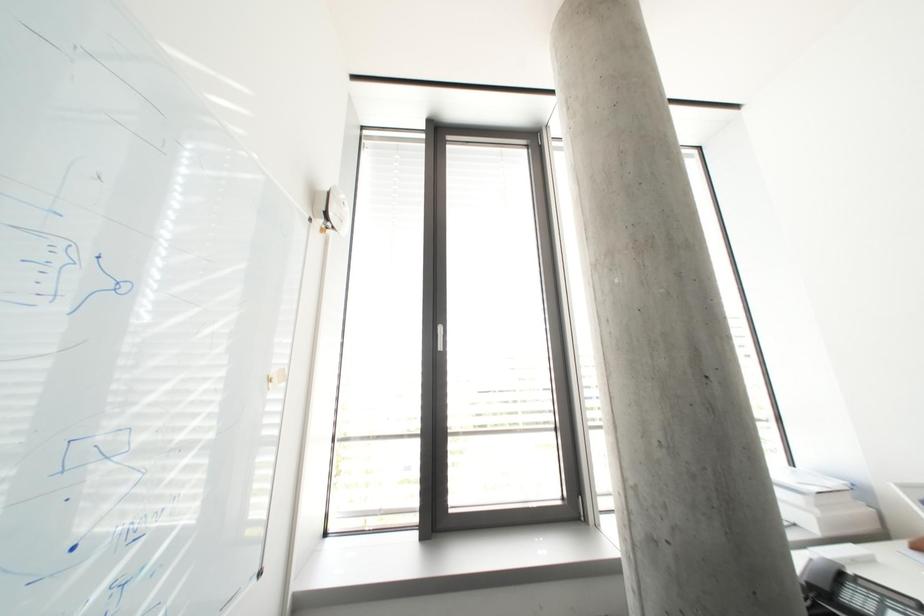
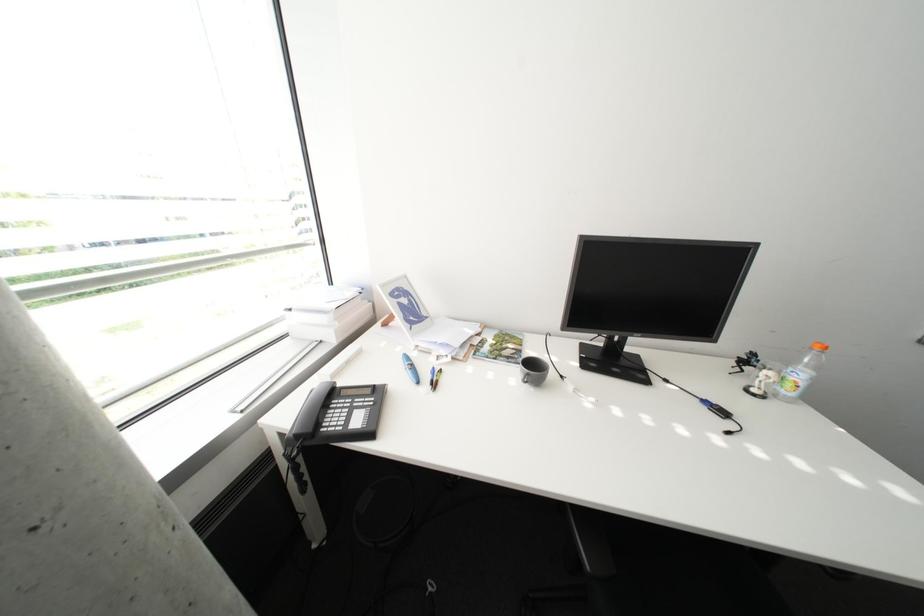
From the picture: The first image is from the beginning of the video and the second image is from the end. How did the camera likely rotate when shooting the video?

The rotation direction of the camera is right-down.